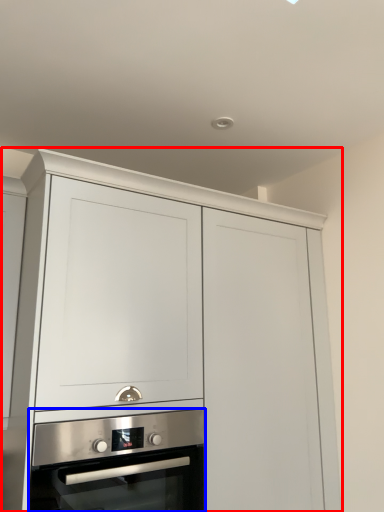
Question: Which object is further to the camera taking this photo, cabinetry (highlighted by a red box) or oven (highlighted by a blue box)?

Choices:
 (A) cabinetry
 (B) oven

Answer: (B)